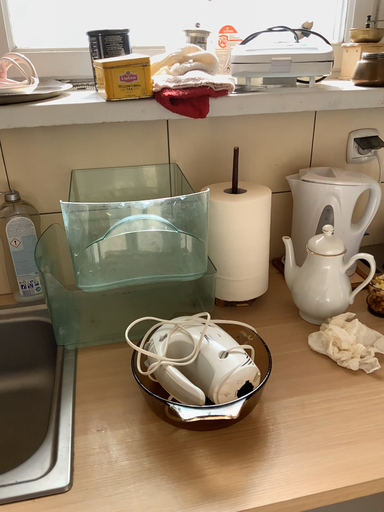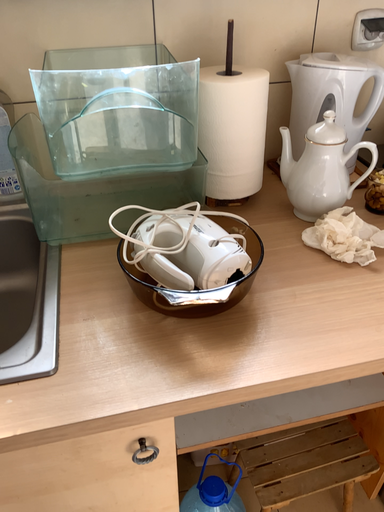
Question: How did the camera likely rotate when shooting the video?

Choices:
 (A) rotated downward
 (B) rotated upward

Answer: (A)